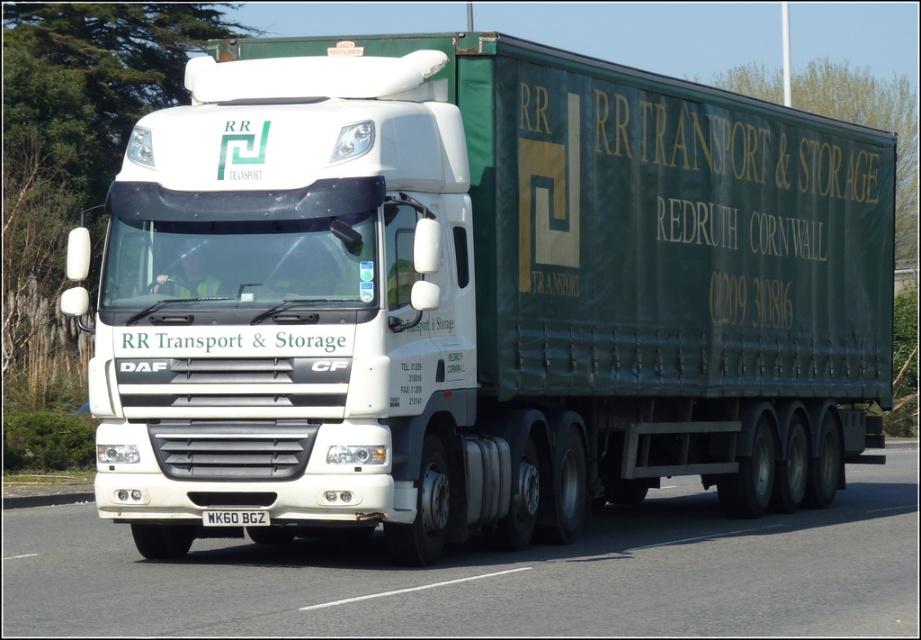
Can you confirm if white glossy truck at center is thinner than black metal/license plate at center?

No.

Does white glossy truck at center appear over black metal/license plate at center?

No.

Does point (430, 596) lie behind point (220, 513)?

No, (430, 596) is closer to viewer.

In order to click on white glossy truck at center in this screenshot , I will do `click(496, 576)`.